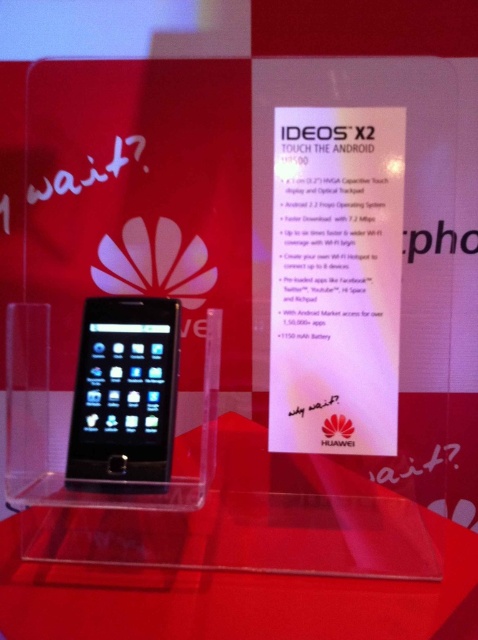
Is transparent acrylic table at center above sleek black phone at center?

Actually, transparent acrylic table at center is below sleek black phone at center.

Who is more distant from viewer, (186, 627) or (150, 490)?

Positioned behind is point (150, 490).

What do you see at coordinates (235, 600) in the screenshot? I see `transparent acrylic table at center` at bounding box center [235, 600].

You are a GUI agent. You are given a task and a screenshot of the screen. Output one action in this format:
    pyautogui.click(x=<x>, y=<y>)
    Task: Click on the transparent acrylic table at center
    Image resolution: width=478 pixels, height=640 pixels.
    Given the screenshot: What is the action you would take?
    pos(235,600)